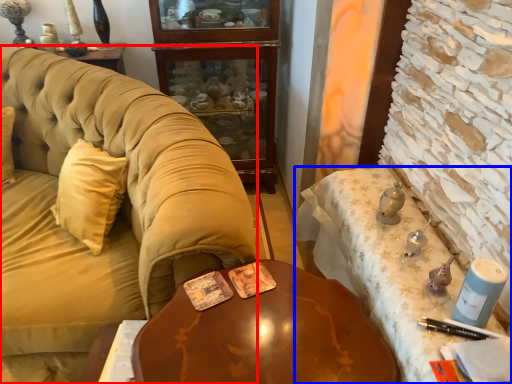
Question: Which object is closer to the camera taking this photo, studio couch (highlighted by a red box) or desk (highlighted by a blue box)?

Choices:
 (A) studio couch
 (B) desk

Answer: (B)